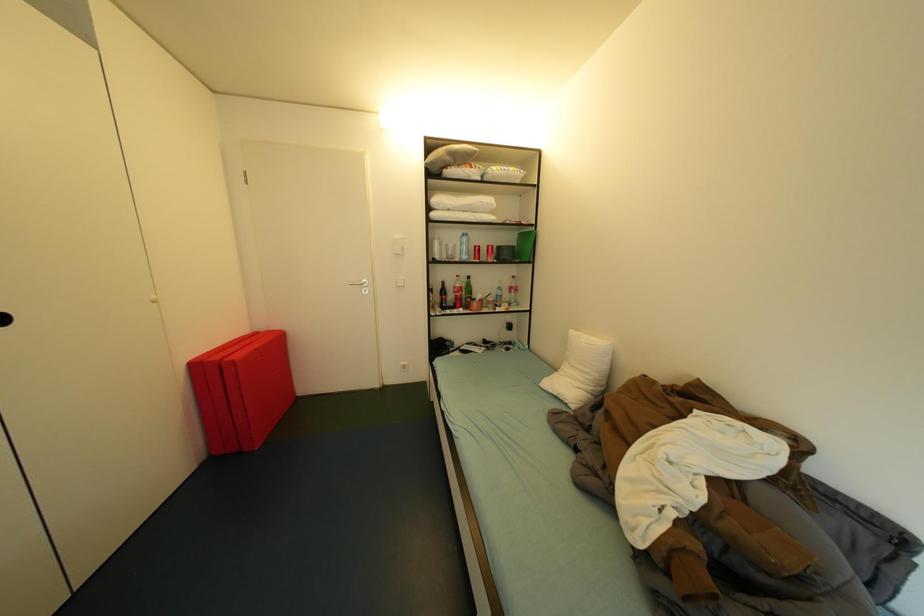
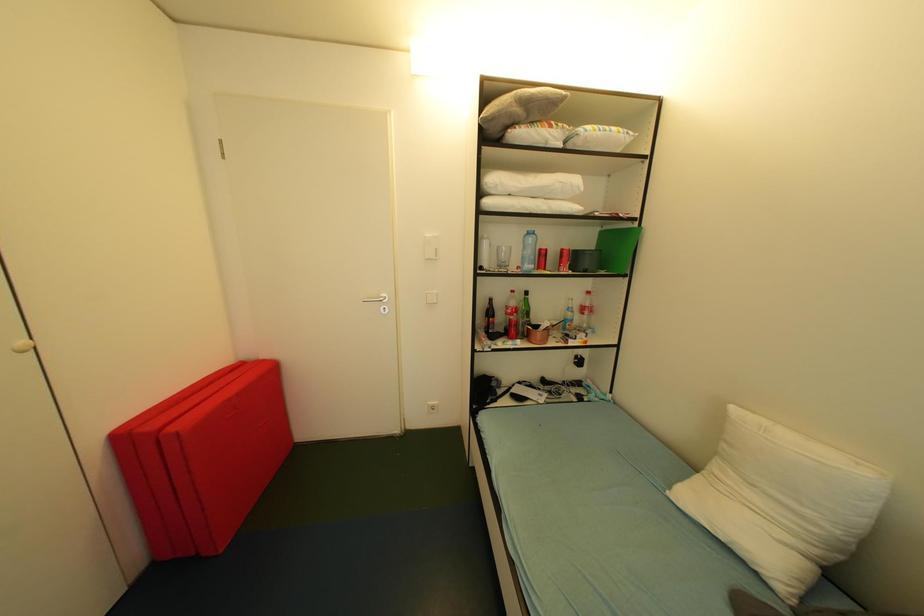
Question: The images are taken continuously from a first-person perspective. In which direction is your viewpoint rotating?

Choices:
 (A) Left
 (B) Right
 (C) Up
 (D) Down

Answer: (A)